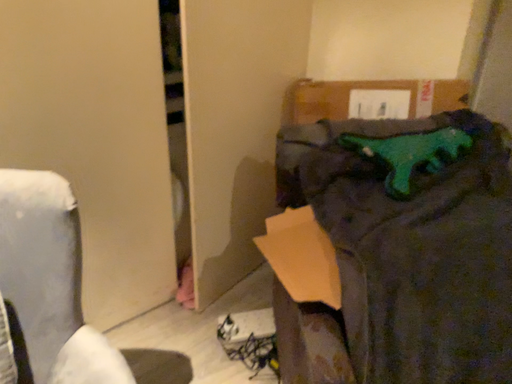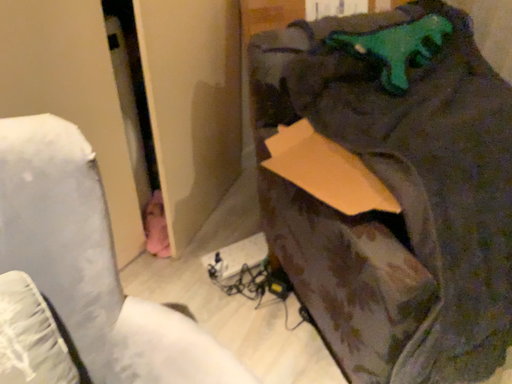
Question: Which way did the camera rotate in the video?

Choices:
 (A) rotated upward
 (B) rotated downward

Answer: (B)